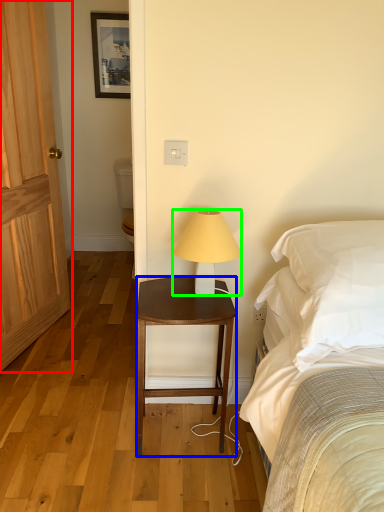
Question: Estimate the real-world distances between objects in this image. Which object is farther from door (highlighted by a red box), nightstand (highlighted by a blue box) or lamp (highlighted by a green box)?

Choices:
 (A) nightstand
 (B) lamp

Answer: (B)